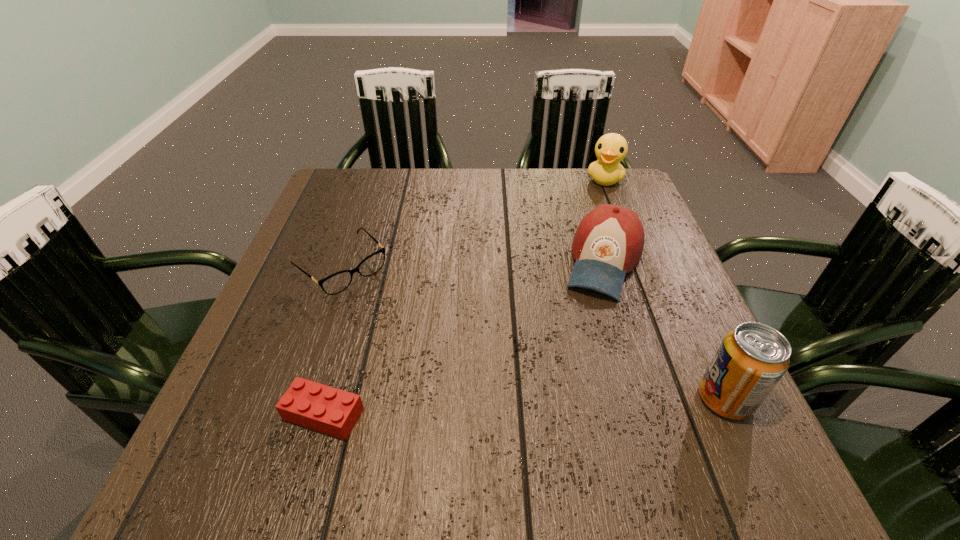
At what (x,y) coordinates should I click in order to perform the action: click on vacant spot on the desktop that is between the Lego and the soda can and is positioned on the front-facing side of the baseball cap. Please return your answer as a coordinate pair (x, y). The width and height of the screenshot is (960, 540). Looking at the image, I should click on (558, 405).

Where is `vacant space on the desktop that is between the Lego and the soda can and is positioned on the front-facing side of the spectacles`? vacant space on the desktop that is between the Lego and the soda can and is positioned on the front-facing side of the spectacles is located at coordinates (491, 408).

The width and height of the screenshot is (960, 540). Identify the location of vacant space on the desktop that is between the Lego and the soda can and is positioned on the face of the farthest object. coord(527,406).